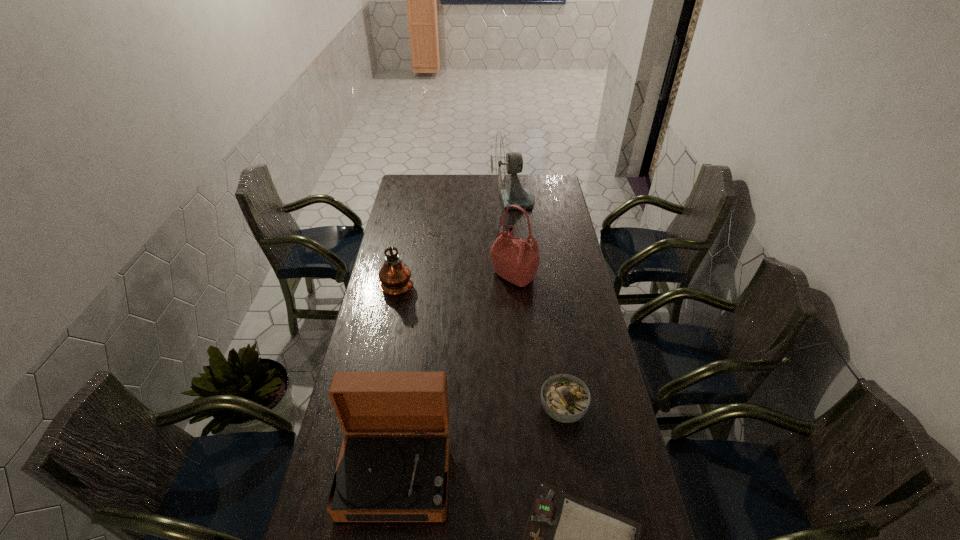
The width and height of the screenshot is (960, 540). Identify the location of free point at the far left corner. (430, 181).

Locate an element on the screen. free space at the far right corner is located at coordinates (548, 174).

The width and height of the screenshot is (960, 540). Find the location of `free spot between the third shortest object and the handbag`. free spot between the third shortest object and the handbag is located at coordinates (455, 374).

At what (x,y) coordinates should I click in order to perform the action: click on free spot between the soup bowl and the fourth tallest object. Please return your answer as a coordinate pair (x, y). This screenshot has height=540, width=960. Looking at the image, I should click on (479, 441).

Locate an element on the screen. vacant area between the handbag and the phonograph record is located at coordinates (455, 374).

The image size is (960, 540). In order to click on unoccupied position between the handbag and the third shortest object in this screenshot , I will do `click(455, 374)`.

The width and height of the screenshot is (960, 540). Identify the location of vacant space that's between the fourth tallest object and the handbag. (455, 374).

The width and height of the screenshot is (960, 540). What are the coordinates of `free spot between the handbag and the oil lamp` in the screenshot? It's located at (455, 279).

The image size is (960, 540). I want to click on the fifth closest object to the farthest object, so click(567, 539).

Locate which object is the fifth closest to the shortest object. Please provide its 2D coordinates. Your answer should be formatted as a tuple, i.e. [(x, y)], where the tuple contains the x and y coordinates of a point satisfying the conditions above.

[(503, 162)]